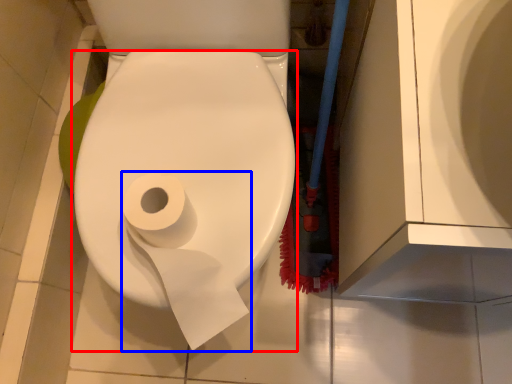
Question: Among these objects, which one is nearest to the camera, toilet paper (highlighted by a red box) or toilet paper (highlighted by a blue box)?

Choices:
 (A) toilet paper
 (B) toilet paper

Answer: (A)